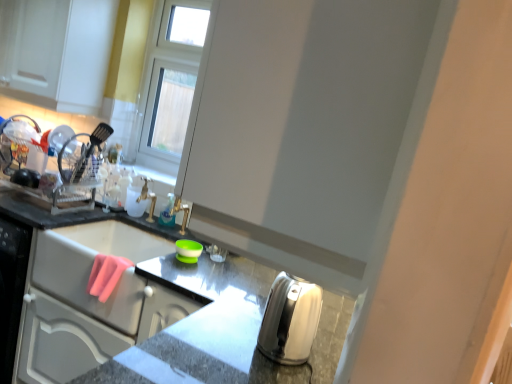
Question: Considering the positions of point (165, 206) and point (283, 344), is point (165, 206) closer or farther from the camera than point (283, 344)?

Choices:
 (A) farther
 (B) closer

Answer: (A)

Question: Considering the positions of translucent plastic bottle at center and satin silver kettle at lower right, placed as the 1th appliance when sorted from right to left, in the image, is translucent plastic bottle at center bigger or smaller than satin silver kettle at lower right, placed as the 1th appliance when sorted from right to left,?

Choices:
 (A) big
 (B) small

Answer: (B)

Question: Which is nearer to the white glossy cabinet at upper left?

Choices:
 (A) green rubber bowl at center, arranged as the first appliance when viewed from the left
 (B) satin silver toaster at lower right
 (C) translucent plastic bottle at center
 (D) satin silver kettle at lower right, placed as the 1th appliance when sorted from right to left
 (E) white glossy sink at upper left

Answer: (C)

Question: Which of these objects is positioned farthest from the satin silver toaster at lower right?

Choices:
 (A) white glossy cabinet at upper left
 (B) white glossy sink at upper left
 (C) satin silver kettle at lower right, placed as the 1th appliance when sorted from right to left
 (D) translucent plastic bottle at center
 (E) green rubber bowl at center, the 2th appliance viewed from the front

Answer: (A)